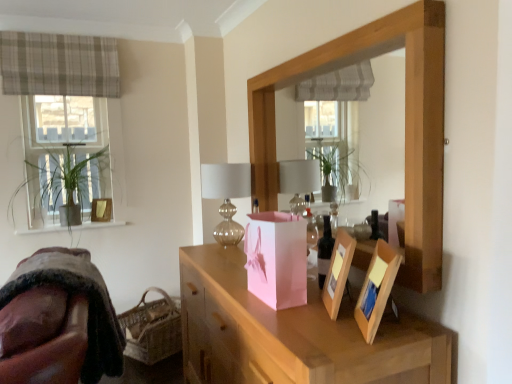
This screenshot has height=384, width=512. I want to click on unoccupied area in front of translucent glass table lamp at center, so click(x=216, y=259).